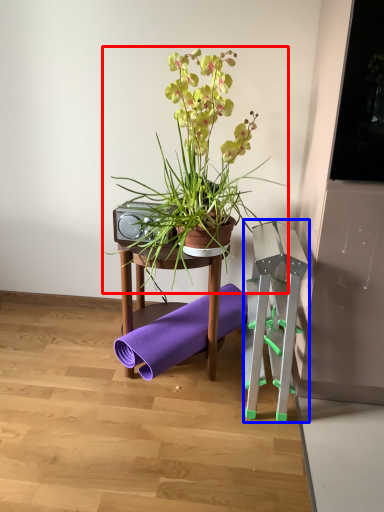
Question: Among these objects, which one is nearest to the camera, houseplant (highlighted by a red box) or step stool (highlighted by a blue box)?

Choices:
 (A) houseplant
 (B) step stool

Answer: (A)